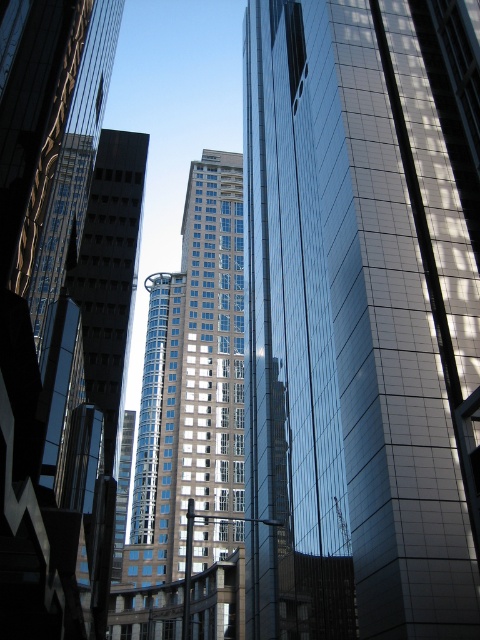
Based on the scene description, where is the shiny glass skyscraper at center located in terms of its 2D coordinates?

The shiny glass skyscraper at center is located at the 2D coordinates of point (361, 316).

You are an architect analyzing the cityscape. You notice two central skyscrapers, the shiny glass skyscraper at center and the glassy blue skyscraper at center. Which one do you think is taller?

The glassy blue skyscraper at center is taller than the shiny glass skyscraper at center according to the description.